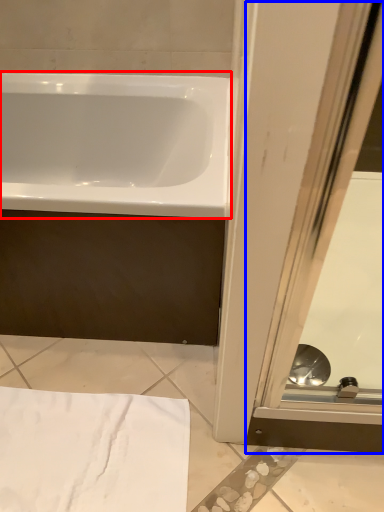
Question: Which object appears farthest to the camera in this image, bathtub (highlighted by a red box) or screen door (highlighted by a blue box)?

Choices:
 (A) bathtub
 (B) screen door

Answer: (B)